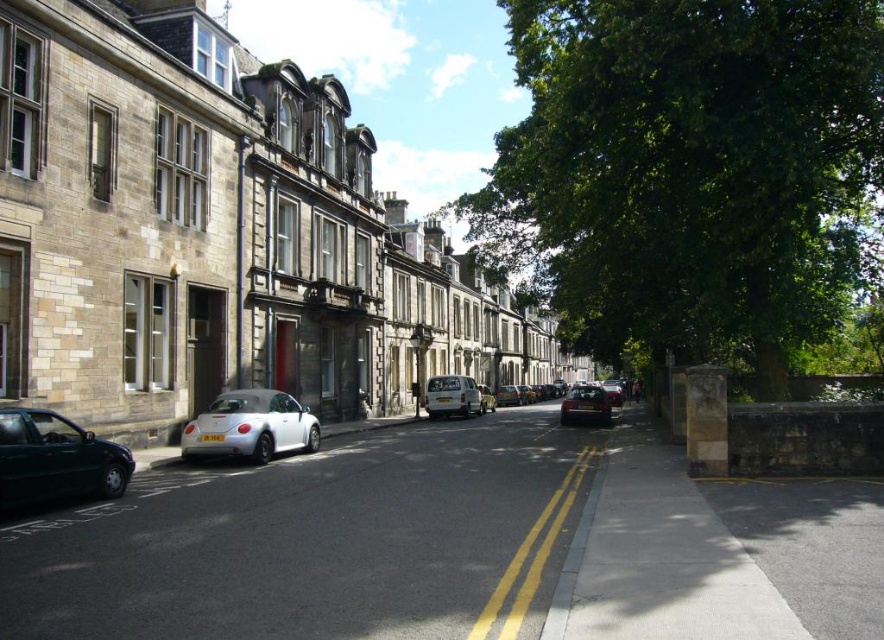
You are a delivery person trying to park your 1.5m tall delivery robot in the parking spot between the white matte convertible at center and the shiny black car at center. Can your robot fit vertically between these two vehicles?

The white matte convertible at center has a lesser height compared to the shiny black car at center. Since the robot is 1.5m tall, it can fit vertically between them as long as the space between the two cars is at least 1.5 meters in height. However, the description only mentions their relative heights, not the available vertical space between them. Without information on the distance between the cars, it is impossible to determine if the robot will fit.

You are a delivery driver who needs to park your vehicle between the silver metallic van at center and the shiny black car at center. Is there enough space between them to fit your 2.5 meter long delivery van?

The silver metallic van at center is positioned on the left side of the shiny black car at center. However, the exact distance between them isn not specified in the provided information. Without knowing the space between them, it is impossible to determine if your delivery van will fit.

You are standing at the point labeled as point (452, 396) in the image. What object is directly in front of you?

The point (452, 396) corresponds to the silver metallic van at center, so the silver metallic van at center is directly in front of you.